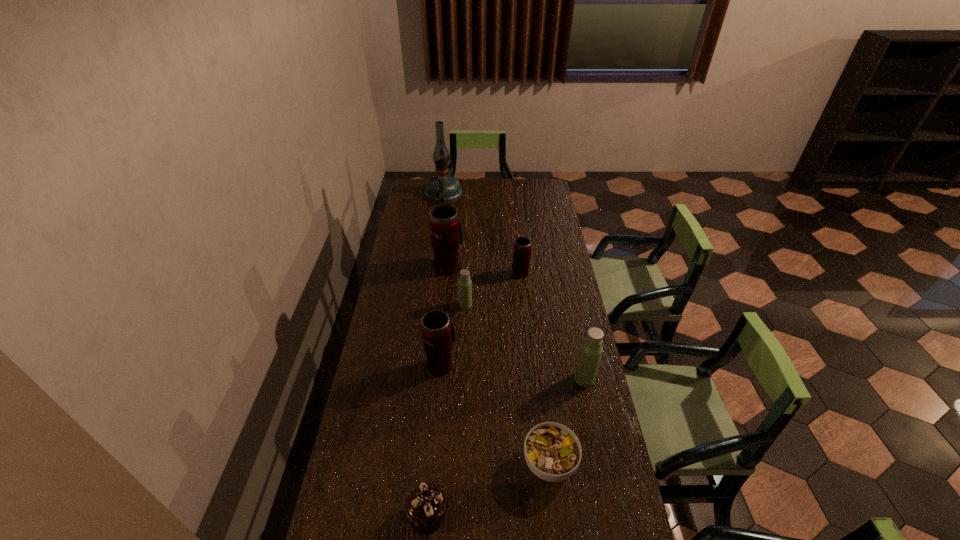
Locate an element on the screen. vacant area located 0.220m on the side with the handle of the second biggest red thermos bottle is located at coordinates (445, 310).

This screenshot has height=540, width=960. I want to click on vacant position located on the side with the handle of the second biggest red thermos bottle, so click(x=446, y=305).

Identify the location of blank space located on the front of the bigger light thermos bottle. (598, 444).

This screenshot has width=960, height=540. Find the location of `vacant area located 0.210m on the side with the handle of the second thermos bottle from right to left`. vacant area located 0.210m on the side with the handle of the second thermos bottle from right to left is located at coordinates (524, 315).

This screenshot has height=540, width=960. I want to click on vacant point located 0.160m on the left of the fourth farthest object, so click(x=420, y=305).

Where is `free spot located on the left of the nearest object`? Image resolution: width=960 pixels, height=540 pixels. free spot located on the left of the nearest object is located at coordinates (373, 516).

The width and height of the screenshot is (960, 540). I want to click on vacant area situated 0.090m on the right of the shortest object, so click(607, 463).

Image resolution: width=960 pixels, height=540 pixels. Find the location of `object positioned at the far edge`. object positioned at the far edge is located at coordinates (442, 188).

Locate an element on the screen. object at the left edge is located at coordinates (442, 188).

At what (x,y) coordinates should I click in order to perform the action: click on thermos bottle present at the right edge. Please return your answer as a coordinate pair (x, y). This screenshot has height=540, width=960. Looking at the image, I should click on (591, 349).